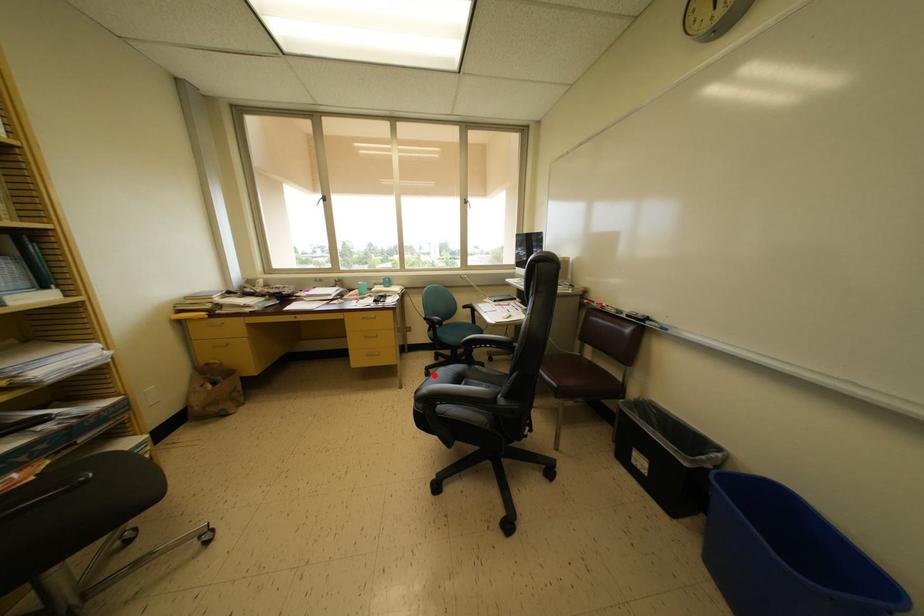
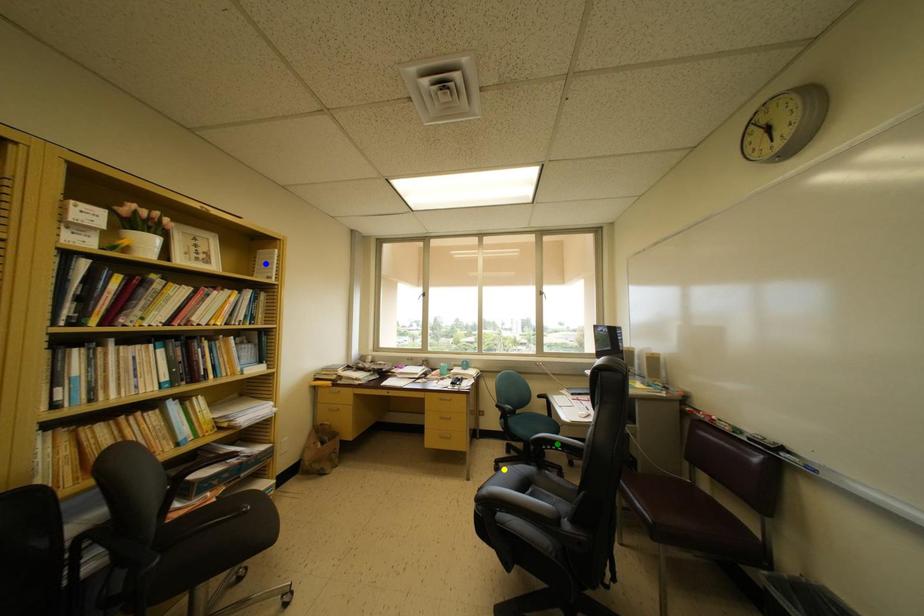
Question: I am providing you with two images of the same scene from different viewpoints. A red point is marked on the first image. You are given multiple points on the second image. Which spot in image 2 lines up with the point in image 1?

Choices:
 (A) yellow point
 (B) green point
 (C) blue point

Answer: (A)